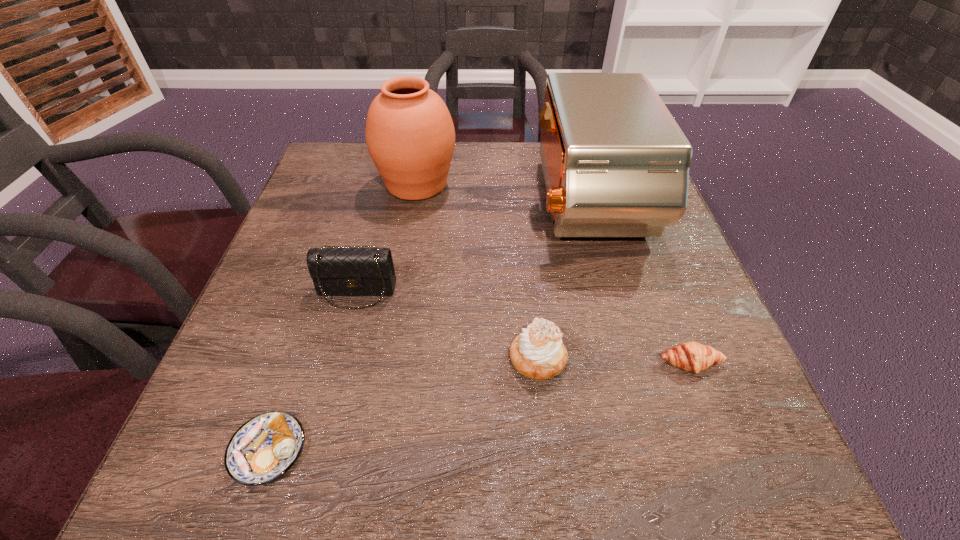
Locate an element on the screen. The image size is (960, 540). urn is located at coordinates (410, 136).

Find the location of `toaster oven`. toaster oven is located at coordinates (616, 164).

Where is `the third farthest object`? Image resolution: width=960 pixels, height=540 pixels. the third farthest object is located at coordinates (357, 271).

Locate an element on the screen. Image resolution: width=960 pixels, height=540 pixels. the tallest pastry is located at coordinates (538, 353).

The width and height of the screenshot is (960, 540). Identify the location of the rightmost pastry. (691, 356).

Where is `the nearest pastry`? the nearest pastry is located at coordinates [265, 447].

Locate an element on the screen. The height and width of the screenshot is (540, 960). the nearest object is located at coordinates (265, 447).

At what (x,y) coordinates should I click in order to perform the action: click on vacant region located 0.300m on the right of the urn. Please return your answer as a coordinate pair (x, y). Looking at the image, I should click on [x=575, y=184].

Locate an element on the screen. free point located 0.190m on the door side of the toaster oven is located at coordinates (454, 205).

Locate an element on the screen. The height and width of the screenshot is (540, 960). vacant space situated 0.270m on the door side of the toaster oven is located at coordinates (420, 205).